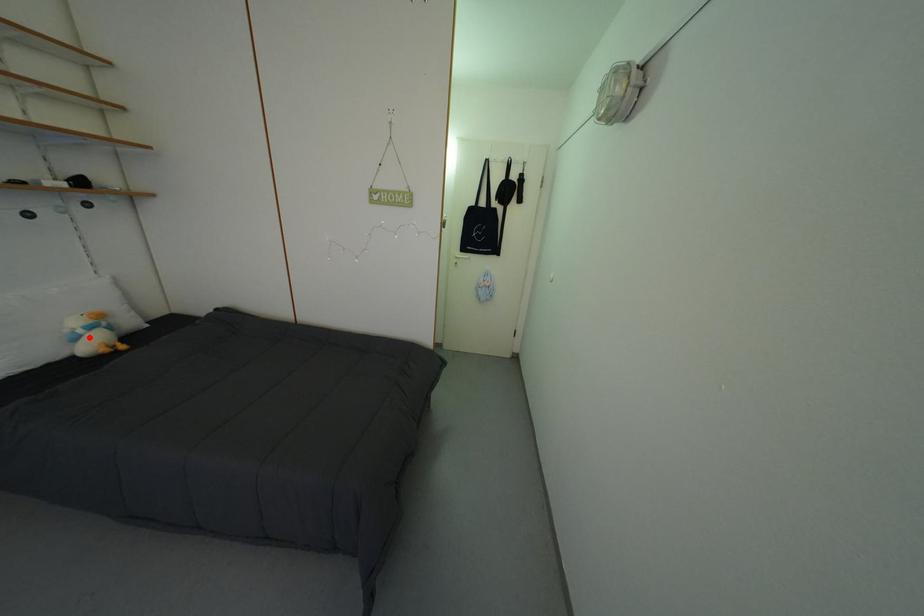
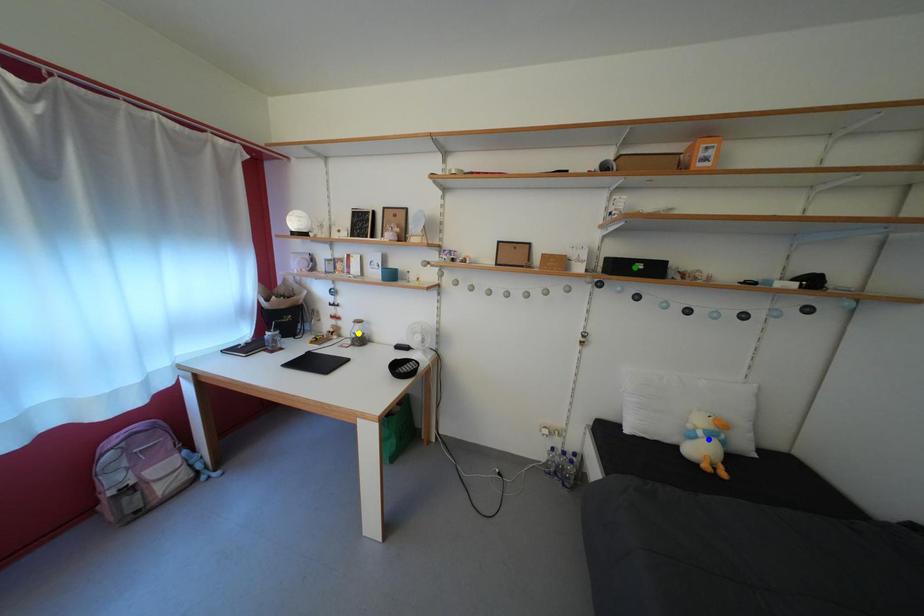
Question: I am providing you with two images of the same scene from different viewpoints. A red point is marked on the first image. You are given multiple points on the second image. In image 2, which mark is for the same physical point as the one in image 1?

Choices:
 (A) blue point
 (B) yellow point
 (C) green point

Answer: (A)